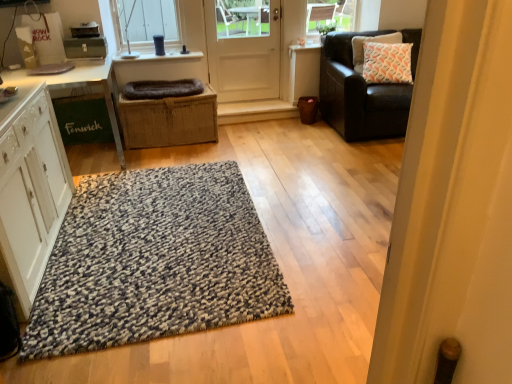
Question: From a real-world perspective, is speckled wool rug at center physically above white matte door at center?

Choices:
 (A) yes
 (B) no

Answer: (B)

Question: Does speckled wool rug at center have a greater height compared to white matte door at center?

Choices:
 (A) yes
 (B) no

Answer: (B)

Question: Is speckled wool rug at center surrounding white matte door at center?

Choices:
 (A) yes
 (B) no

Answer: (B)

Question: From the image's perspective, is speckled wool rug at center over white matte door at center?

Choices:
 (A) yes
 (B) no

Answer: (B)

Question: Can you confirm if speckled wool rug at center is bigger than white matte door at center?

Choices:
 (A) yes
 (B) no

Answer: (B)

Question: Relative to white printed cushion at upper right, is braided wicker basket at center in front or behind?

Choices:
 (A) behind
 (B) front

Answer: (B)

Question: From the image's perspective, relative to white printed cushion at upper right, is braided wicker basket at center above or below?

Choices:
 (A) above
 (B) below

Answer: (B)

Question: From their relative heights in the image, would you say braided wicker basket at center is taller or shorter than white printed cushion at upper right?

Choices:
 (A) tall
 (B) short

Answer: (A)

Question: Looking at their shapes, would you say braided wicker basket at center is wider or thinner than white printed cushion at upper right?

Choices:
 (A) wide
 (B) thin

Answer: (A)

Question: Considering the relative positions of white printed cushion at upper right and white wood cabinet at left in the image provided, is white printed cushion at upper right to the left or to the right of white wood cabinet at left?

Choices:
 (A) right
 (B) left

Answer: (A)

Question: Is white printed cushion at upper right wider or thinner than white wood cabinet at left?

Choices:
 (A) wide
 (B) thin

Answer: (B)

Question: In the image, is white printed cushion at upper right positioned in front of or behind white wood cabinet at left?

Choices:
 (A) behind
 (B) front

Answer: (A)

Question: Is white printed cushion at upper right taller or shorter than white wood cabinet at left?

Choices:
 (A) short
 (B) tall

Answer: (A)

Question: Based on their sizes in the image, would you say white glossy table at left is bigger or smaller than dark gray plush dog bed at center?

Choices:
 (A) small
 (B) big

Answer: (B)

Question: Is white glossy table at left inside the boundaries of dark gray plush dog bed at center, or outside?

Choices:
 (A) outside
 (B) inside

Answer: (A)